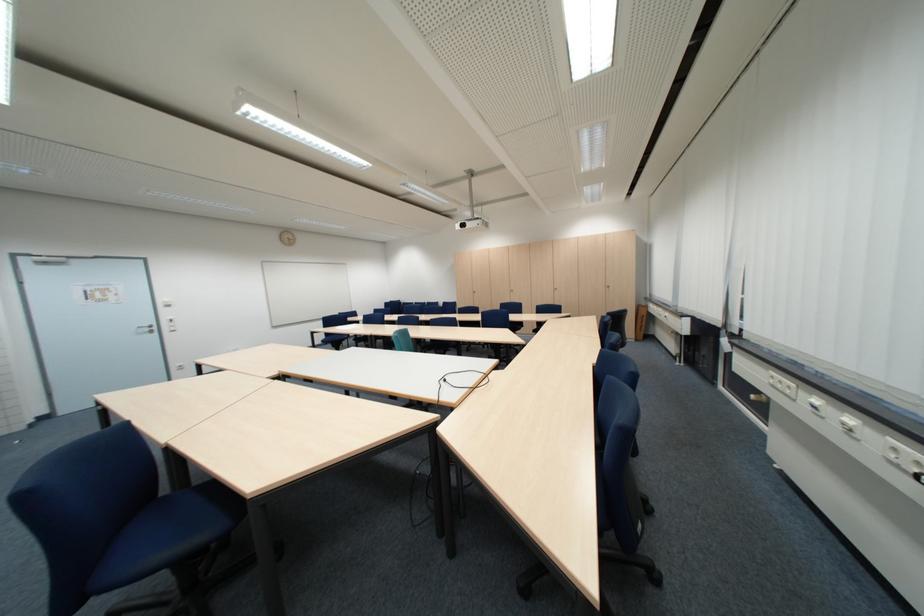
In order to click on silver door handle in this screenshot , I will do `click(144, 329)`.